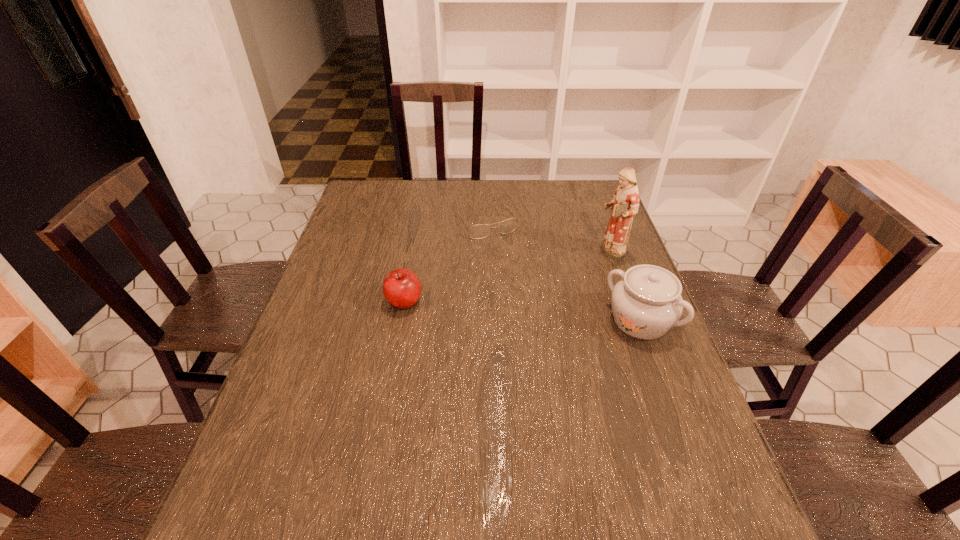
You are a GUI agent. You are given a task and a screenshot of the screen. Output one action in this format:
    pyautogui.click(x=<x>, y=<y>)
    Task: Click on the free spot on the desktop that is between the leftmost object and the second tallest object and is positioned on the front-facing side of the tallest object
    The height and width of the screenshot is (540, 960).
    Given the screenshot: What is the action you would take?
    pyautogui.click(x=485, y=308)

You are a GUI agent. You are given a task and a screenshot of the screen. Output one action in this format:
    pyautogui.click(x=<x>, y=<y>)
    Task: Click on the free space on the desktop that is between the apple and the second tallest object and is positioned on the front-facing side of the farthest object
    This screenshot has height=540, width=960.
    Given the screenshot: What is the action you would take?
    pyautogui.click(x=541, y=313)